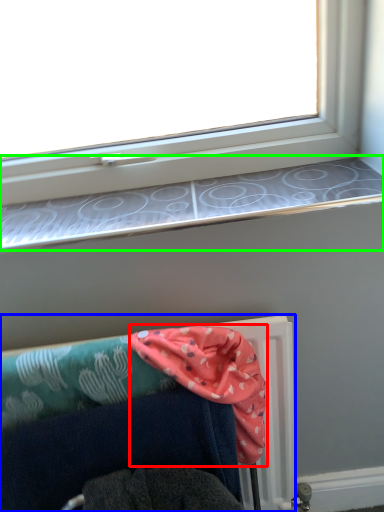
Question: Based on their relative distances, which object is nearer to scarf (highlighted by a red box)? Choose from furniture (highlighted by a blue box) and window sill (highlighted by a green box).

Choices:
 (A) furniture
 (B) window sill

Answer: (A)